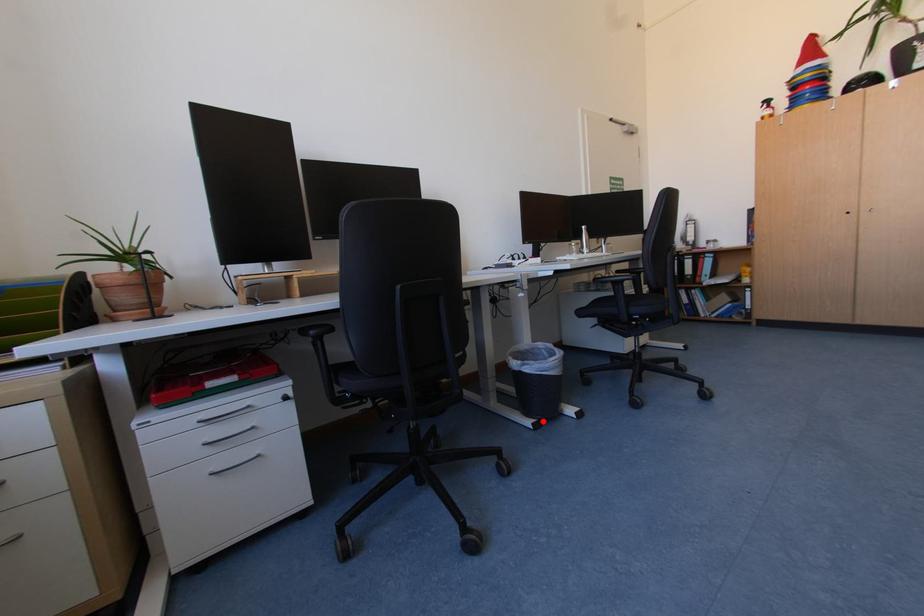
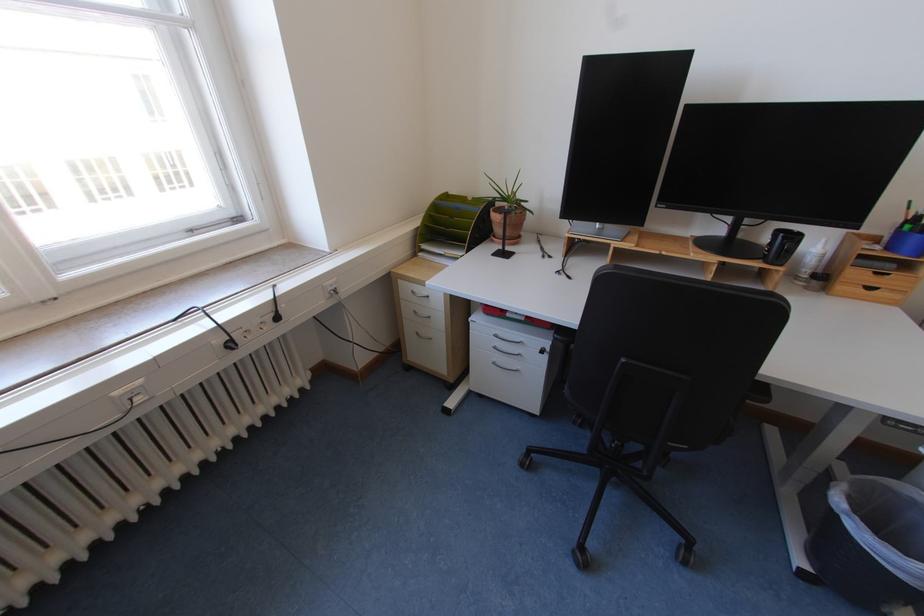
Question: I am providing you with two images of the same scene from different viewpoints. In image1, a red point is highlighted. Considering the same 3D point in image2, which of the following is correct?

Choices:
 (A) It is closer
 (B) It is farther

Answer: (A)